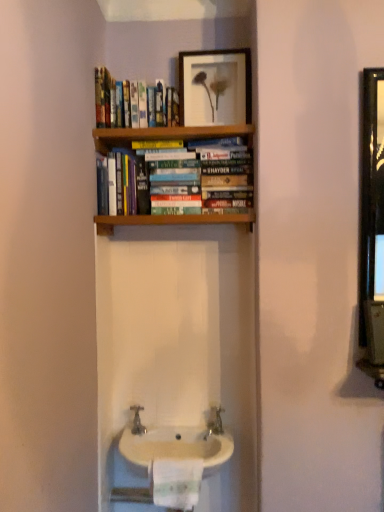
Question: Does hardcover books at upper center have a larger size compared to white glossy sink at lower center?

Choices:
 (A) no
 (B) yes

Answer: (A)

Question: From a real-world perspective, is hardcover books at upper center below white glossy sink at lower center?

Choices:
 (A) yes
 (B) no

Answer: (B)

Question: Is hardcover books at upper center placed right next to white glossy sink at lower center?

Choices:
 (A) no
 (B) yes

Answer: (A)

Question: Does hardcover books at upper center appear on the right side of white glossy sink at lower center?

Choices:
 (A) yes
 (B) no

Answer: (B)

Question: Does hardcover books at upper center come behind white glossy sink at lower center?

Choices:
 (A) no
 (B) yes

Answer: (B)

Question: Considering the relative positions of hardcover books at upper center and white glossy sink at lower center in the image provided, is hardcover books at upper center to the left of white glossy sink at lower center from the viewer's perspective?

Choices:
 (A) no
 (B) yes

Answer: (B)

Question: From a real-world perspective, is white glossy sink at lower center under hardcover books at upper center?

Choices:
 (A) yes
 (B) no

Answer: (A)

Question: From a real-world perspective, is white glossy sink at lower center located higher than hardcover books at upper center?

Choices:
 (A) yes
 (B) no

Answer: (B)

Question: Can you confirm if white glossy sink at lower center is thinner than hardcover books at upper center?

Choices:
 (A) yes
 (B) no

Answer: (B)

Question: Would you say white glossy sink at lower center is outside hardcover books at upper center?

Choices:
 (A) no
 (B) yes

Answer: (B)

Question: Considering the relative positions of white glossy sink at lower center and hardcover books at upper center in the image provided, is white glossy sink at lower center to the right of hardcover books at upper center from the viewer's perspective?

Choices:
 (A) yes
 (B) no

Answer: (A)

Question: Is white glossy sink at lower center at the left side of hardcover books at upper center?

Choices:
 (A) no
 (B) yes

Answer: (A)

Question: Is silver metallic tap at center next to white paper towel at lower center?

Choices:
 (A) no
 (B) yes

Answer: (A)